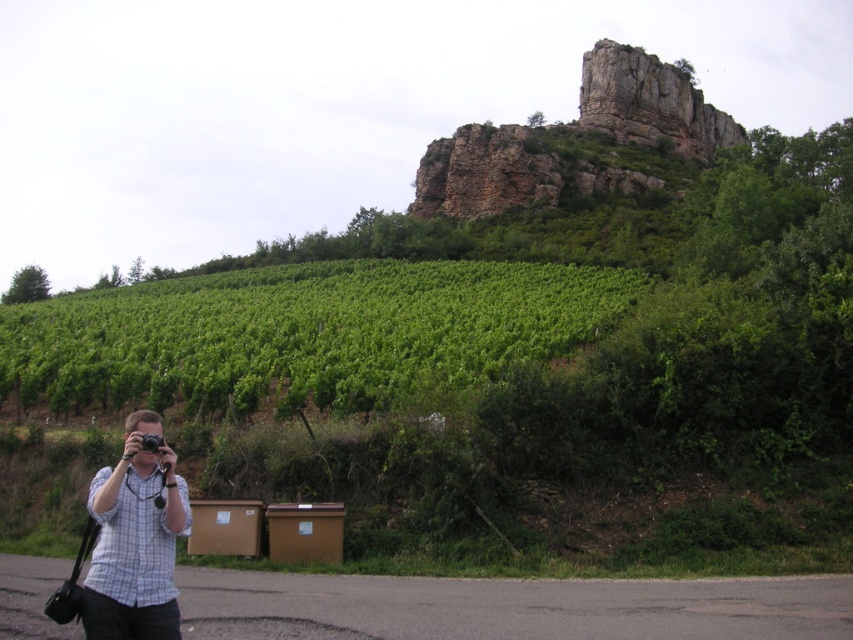
Question: Can you confirm if rusty stone cliff at upper center is positioned above white checkered shirt at lower left?

Choices:
 (A) no
 (B) yes

Answer: (B)

Question: Can you confirm if rusty stone cliff at upper center is wider than white checkered shirt at lower left?

Choices:
 (A) no
 (B) yes

Answer: (B)

Question: Considering the relative positions of rusty stone cliff at upper center and white checkered shirt at lower left in the image provided, where is rusty stone cliff at upper center located with respect to white checkered shirt at lower left?

Choices:
 (A) above
 (B) below

Answer: (A)

Question: Among these objects, which one is farthest from the camera?

Choices:
 (A) white checkered shirt at lower left
 (B) rusty stone cliff at upper center

Answer: (B)